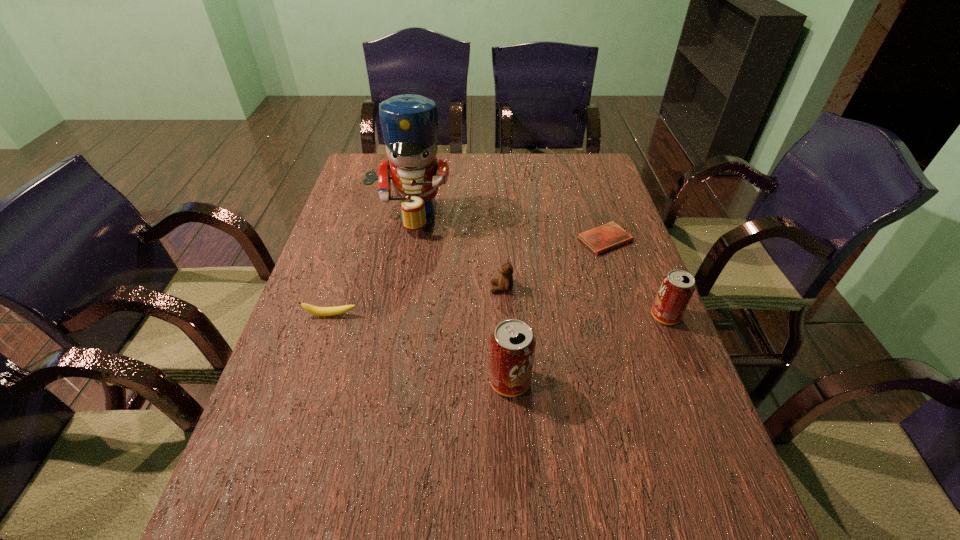
Where is `free space between the shortest object and the farther soda can`? free space between the shortest object and the farther soda can is located at coordinates pyautogui.click(x=635, y=278).

At what (x,y) coordinates should I click in order to perform the action: click on blank region between the shortest object and the nutcracker. Please return your answer as a coordinate pair (x, y). Looking at the image, I should click on (508, 228).

This screenshot has height=540, width=960. Identify the location of blank region between the nearer soda can and the diary. (558, 310).

Identify the location of blank region between the third tallest object and the shortest object. (635, 278).

At what (x,y) coordinates should I click in order to perform the action: click on object that can be found as the third closest to the nutcracker. Please return your answer as a coordinate pair (x, y). Looking at the image, I should click on (600, 239).

Locate an element on the screen. the second closest object relative to the nutcracker is located at coordinates (319, 311).

Locate an element on the screen. The height and width of the screenshot is (540, 960). free location that satisfies the following two spatial constraints: 1. at the face of the nearer soda can; 2. on the right side of the third farthest object is located at coordinates (506, 381).

Where is `blank area in the image that satisfies the following two spatial constraints: 1. on the back side of the left soda can; 2. on the right side of the diary`? The width and height of the screenshot is (960, 540). blank area in the image that satisfies the following two spatial constraints: 1. on the back side of the left soda can; 2. on the right side of the diary is located at coordinates (502, 240).

Where is `vacant space that satisfies the following two spatial constraints: 1. on the upward curve of the banana; 2. on the right side of the farther soda can`? Image resolution: width=960 pixels, height=540 pixels. vacant space that satisfies the following two spatial constraints: 1. on the upward curve of the banana; 2. on the right side of the farther soda can is located at coordinates (330, 316).

Image resolution: width=960 pixels, height=540 pixels. I want to click on vacant point that satisfies the following two spatial constraints: 1. at the face of the fourth tallest object; 2. on the back side of the nearest object, so click(506, 381).